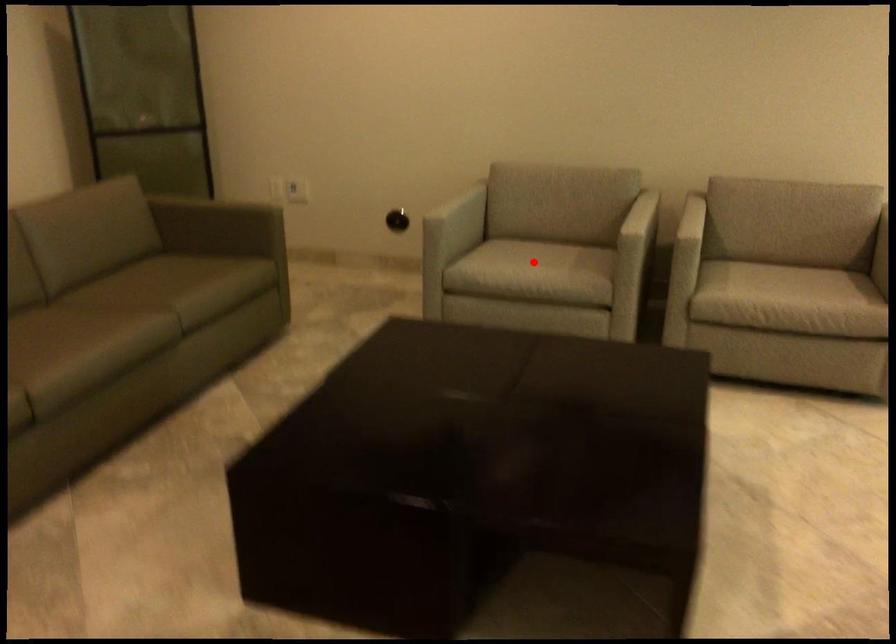
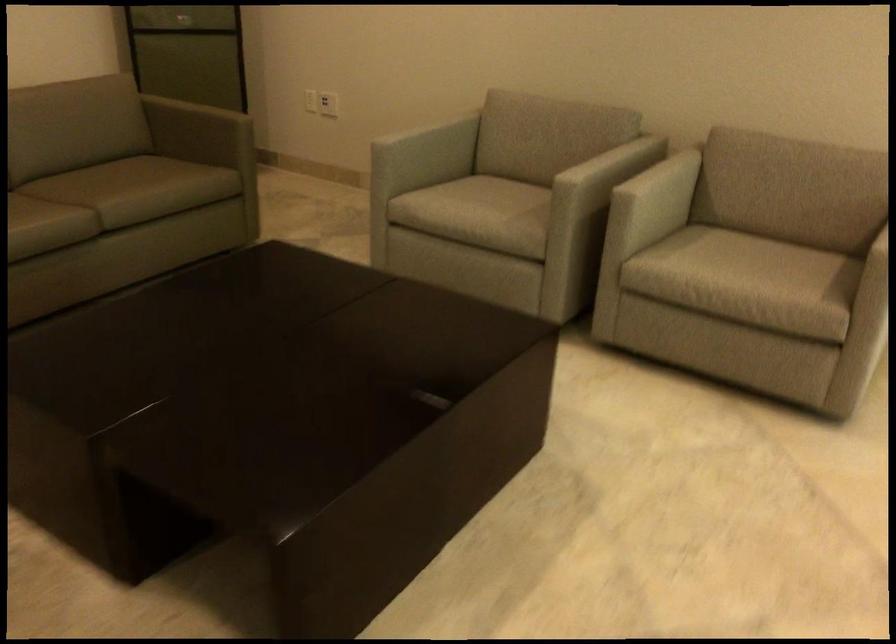
Question: I am providing you with two images of the same scene from different viewpoints. Image1 has a red point marked. In image2, the corresponding 3D location appears at what relative position? Reply with the corresponding letter.

Choices:
 (A) Closer
 (B) Farther

Answer: (A)